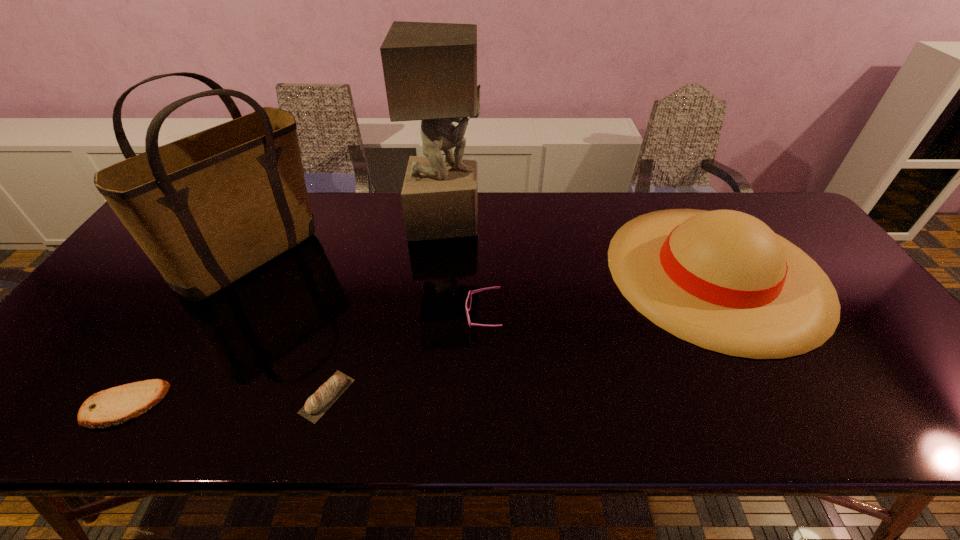
Locate an element on the screen. blank space located on the front-facing side of the sunglasses is located at coordinates (316, 317).

Image resolution: width=960 pixels, height=540 pixels. In order to click on vacant space situated on the front-facing side of the sunglasses in this screenshot , I will do `click(410, 317)`.

Identify the location of vacant space positioned 0.170m on the front-facing side of the sunglasses. (398, 317).

The width and height of the screenshot is (960, 540). I want to click on vacant point located on the right of the right pita bread, so click(x=462, y=396).

I want to click on vacant area situated 0.100m on the right of the left pita bread, so click(208, 405).

Identify the location of sculpture that is at the far edge. (430, 69).

Find the location of a particular element. The height and width of the screenshot is (540, 960). tote bag that is at the far edge is located at coordinates (207, 209).

The width and height of the screenshot is (960, 540). I want to click on sombrero that is at the far edge, so click(x=723, y=280).

I want to click on object that is positioned at the right edge, so click(723, 280).

The width and height of the screenshot is (960, 540). What are the coordinates of `object present at the far right corner` in the screenshot? It's located at (723, 280).